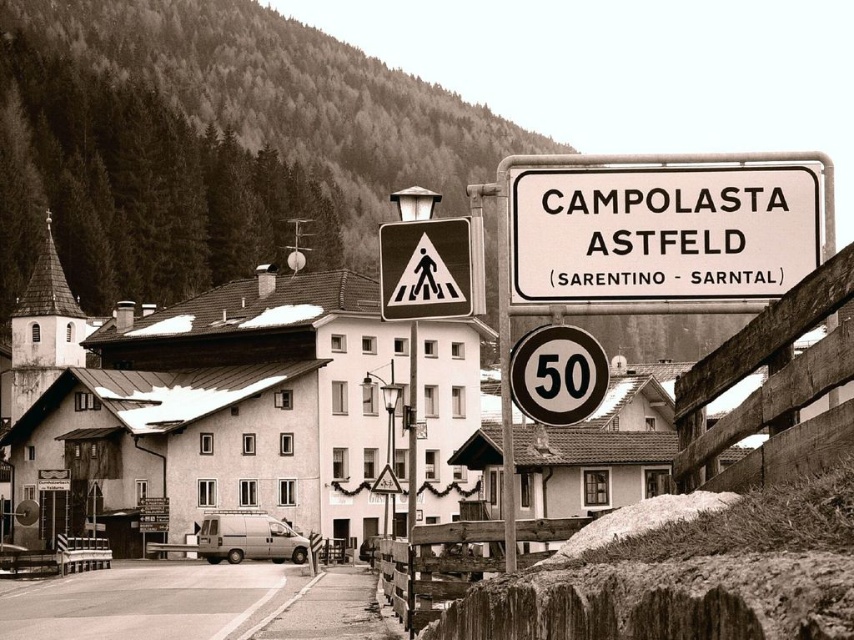
Who is positioned more to the left, white matte building at center or white paper sign at upper center?

Positioned to the left is white matte building at center.

At what (x,y) coordinates should I click in order to perform the action: click on white matte building at center. Please return your answer as a coordinate pair (x, y). The image size is (854, 640). Looking at the image, I should click on (200, 404).

The height and width of the screenshot is (640, 854). In order to click on white matte building at center in this screenshot , I will do [200, 404].

Based on the photo, is white paper sign at upper center smaller than metallic circular speed limit sign at center?

No.

Who is lower down, white paper sign at upper center or metallic circular speed limit sign at center?

Positioned lower is metallic circular speed limit sign at center.

Locate an element on the screen. white paper sign at upper center is located at coordinates tap(664, 230).

Identify the location of white paper sign at upper center. (664, 230).

Who is more distant from viewer, [202,497] or [531,401]?

The point [202,497] is behind.

Is white matte building at center thinner than metallic circular speed limit sign at center?

No, white matte building at center is not thinner than metallic circular speed limit sign at center.

At what (x,y) coordinates should I click in order to perform the action: click on white matte building at center. Please return your answer as a coordinate pair (x, y). The image size is (854, 640). Looking at the image, I should click on (200, 404).